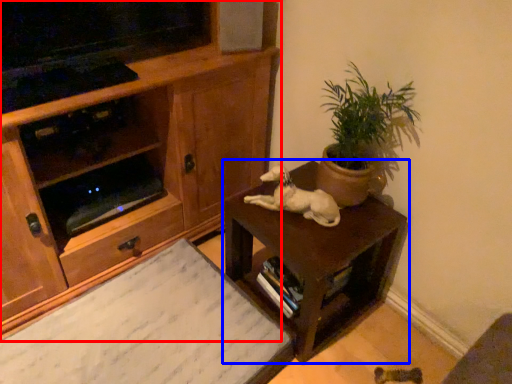
Question: Which point is closer to the camera, cabinetry (highlighted by a red box) or table (highlighted by a blue box)?

Choices:
 (A) cabinetry
 (B) table

Answer: (A)